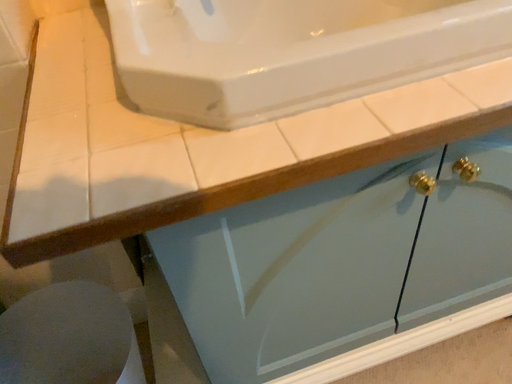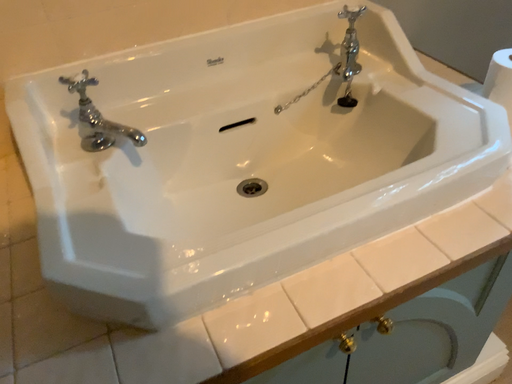
Question: How did the camera likely rotate when shooting the video?

Choices:
 (A) rotated right
 (B) rotated left

Answer: (A)